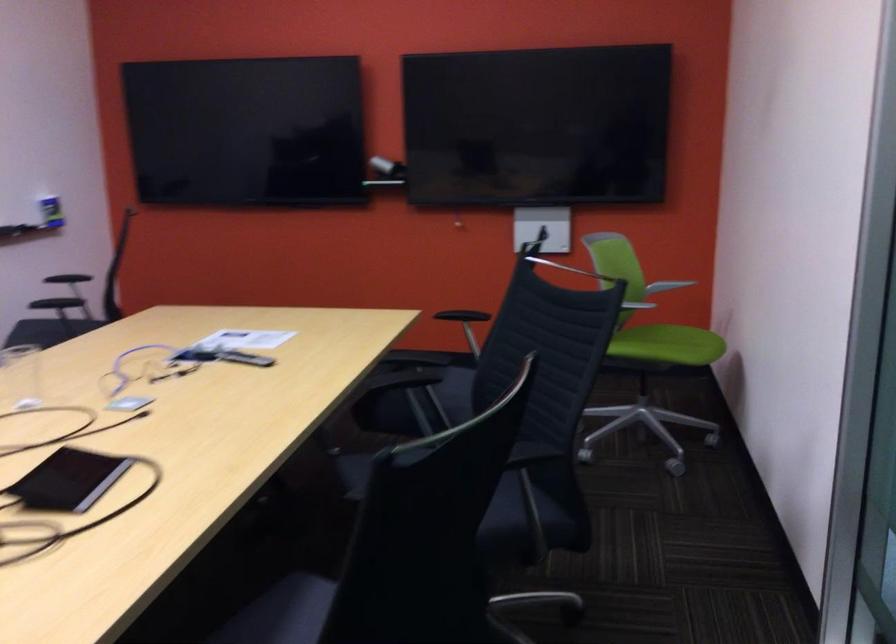
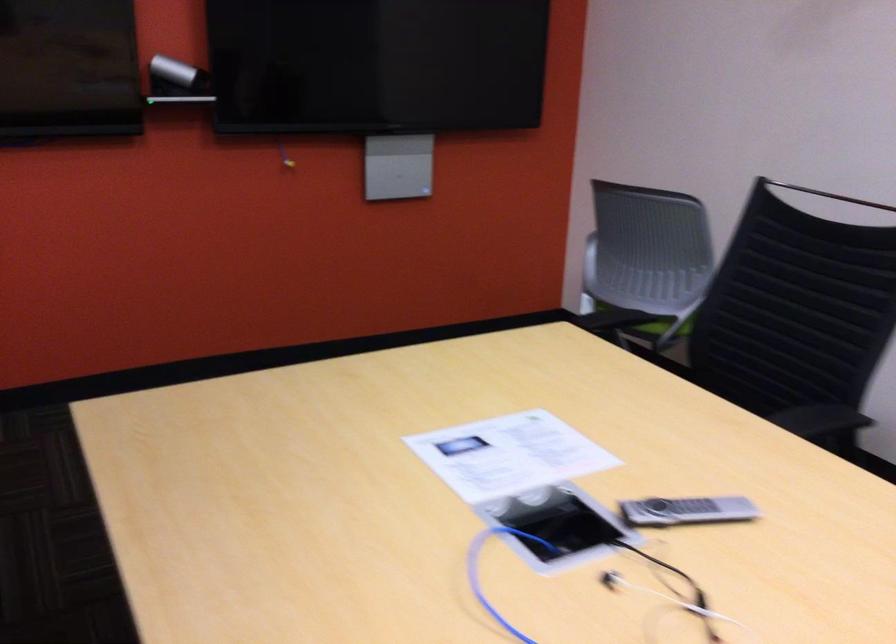
Where in the second image is the point corresponding to point (612, 355) from the first image?

(653, 325)